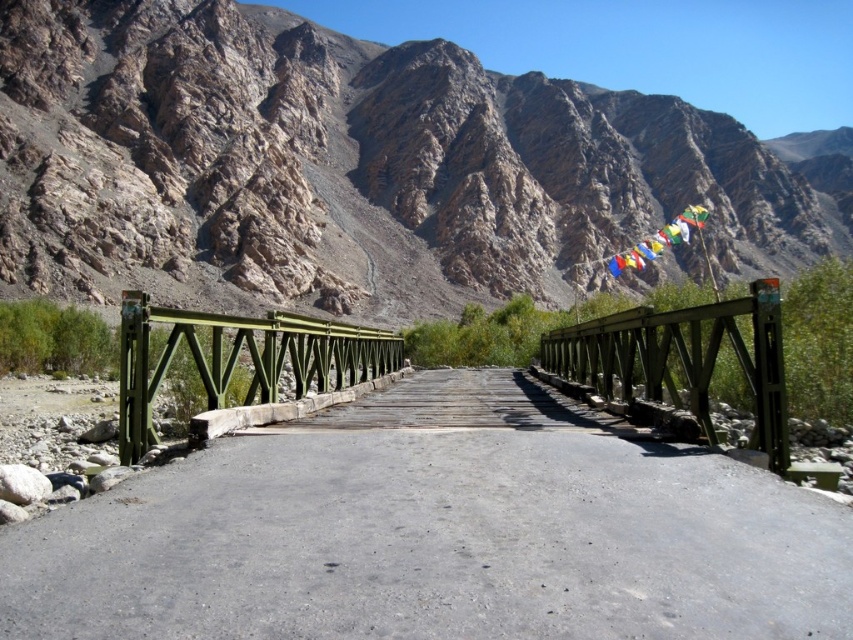
You are standing on the smooth concrete bridge at center and want to walk to the green wooden bridge at upper center. Which direction should you move towards?

You should move towards the right because the smooth concrete bridge at center is to the left of the green wooden bridge at upper center, so moving right would lead you towards it.

You are a hiker planning to cross the river using the smooth concrete bridge at center and the green wooden bridge at upper center. Which bridge is closer to you if you are standing on the other side of the river?

The smooth concrete bridge at center is closer to you since it is only 49.23 feet away from the green wooden bridge at upper center, meaning it is nearer to your position on the other side of the river.

You are a hiker standing on the green wooden bridge at upper center and looking towards the rugged stone mountain at upper center. Which object appears wider from your perspective?

The rugged stone mountain at upper center appears wider than the green wooden bridge at upper center from your perspective because its width surpasses the bridge.